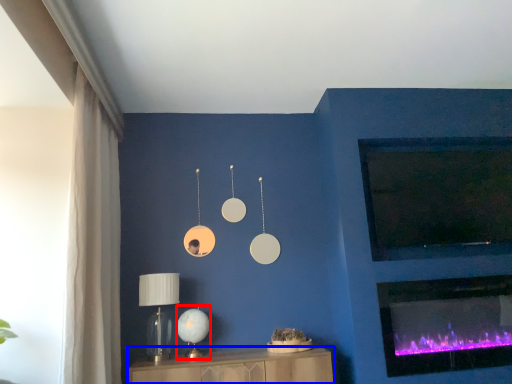
Question: Among these objects, which one is nearest to the camera, table lamp (highlighted by a red box) or furniture (highlighted by a blue box)?

Choices:
 (A) table lamp
 (B) furniture

Answer: (B)